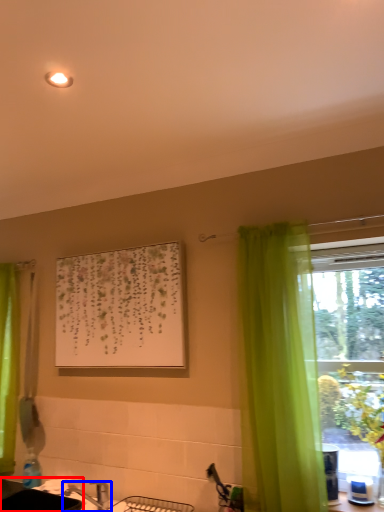
Question: Which object is closer to the camera taking this photo, sink (highlighted by a red box) or tap (highlighted by a blue box)?

Choices:
 (A) sink
 (B) tap

Answer: (A)